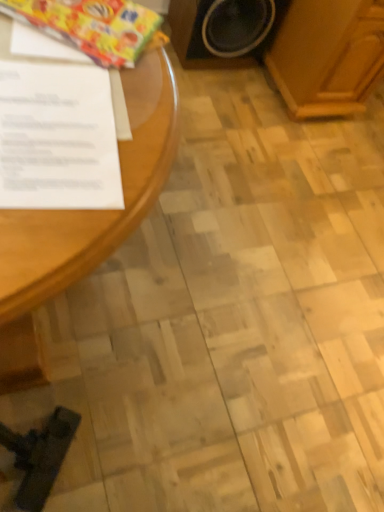
I want to click on vacant region above shiny plastic wrapping paper at upper left (from a real-world perspective), so [x=90, y=19].